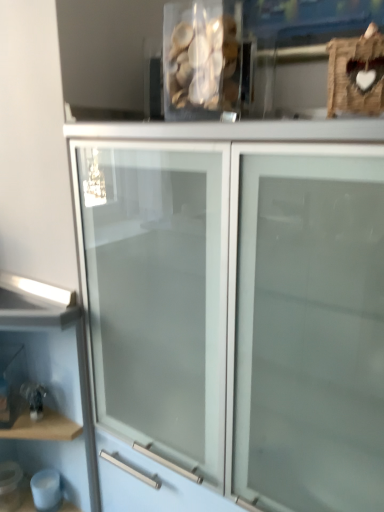
Question: Is wooden shelf at lower left positioned beyond the bounds of white frosted glass cabinet at center?

Choices:
 (A) yes
 (B) no

Answer: (A)

Question: From a real-world perspective, is wooden shelf at lower left on white frosted glass cabinet at center?

Choices:
 (A) yes
 (B) no

Answer: (B)

Question: Could white frosted glass cabinet at center be considered to be inside wooden shelf at lower left?

Choices:
 (A) yes
 (B) no

Answer: (B)

Question: Can you confirm if wooden shelf at lower left is smaller than white frosted glass cabinet at center?

Choices:
 (A) no
 (B) yes

Answer: (B)

Question: Can you confirm if wooden shelf at lower left is wider than white frosted glass cabinet at center?

Choices:
 (A) no
 (B) yes

Answer: (A)

Question: Is wooden shelf at lower left facing towards white frosted glass cabinet at center?

Choices:
 (A) no
 (B) yes

Answer: (A)

Question: Is translucent plastic container at upper center with white frosted glass cabinet at center?

Choices:
 (A) yes
 (B) no

Answer: (B)

Question: Is translucent plastic container at upper center to the right of white frosted glass cabinet at center from the viewer's perspective?

Choices:
 (A) yes
 (B) no

Answer: (B)

Question: From a real-world perspective, is translucent plastic container at upper center under white frosted glass cabinet at center?

Choices:
 (A) no
 (B) yes

Answer: (A)

Question: Is white frosted glass cabinet at center at the back of translucent plastic container at upper center?

Choices:
 (A) yes
 (B) no

Answer: (B)

Question: Considering the relative sizes of translucent plastic container at upper center and white frosted glass cabinet at center in the image provided, is translucent plastic container at upper center shorter than white frosted glass cabinet at center?

Choices:
 (A) no
 (B) yes

Answer: (B)

Question: Can you confirm if translucent plastic container at upper center is wider than white frosted glass cabinet at center?

Choices:
 (A) no
 (B) yes

Answer: (A)

Question: Is translucent plastic container at upper center at the back of white frosted glass cabinet at center?

Choices:
 (A) no
 (B) yes

Answer: (A)